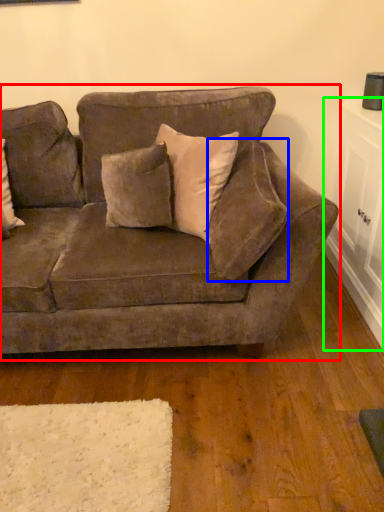
Question: Estimate the real-world distances between objects in this image. Which object is closer to studio couch (highlighted by a red box), pillow (highlighted by a blue box) or table (highlighted by a green box)?

Choices:
 (A) pillow
 (B) table

Answer: (A)